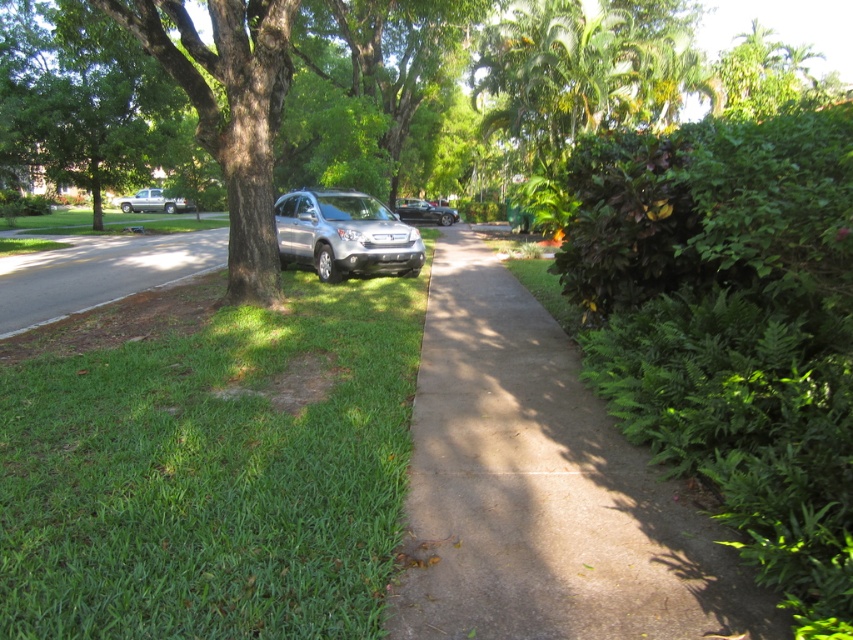
You are a delivery person trying to park your vehicle in a narrow alley that can only accommodate vehicles up to 6 feet in height. You see the silver metallic truck at left and the satin black sedan at center. Which vehicle should you choose to park in the alley?

The satin black sedan at center should be chosen because it is shorter than the silver metallic truck at left, making it suitable for the alley with a 6 feet height restriction.

You are standing at the center of the sidewalk on this suburban street. You see the silver metallic truck at left. Based on its position, can you estimate how far it is from the edge of the sidewalk?

The silver metallic truck at left is positioned at point (152, 202), which indicates it is relatively close to the edge of the sidewalk. However, without specific measurements of the sidewalk width or scale reference, an exact distance cannot be determined. It would be advisable to check local parking regulations or visible markings for proper positioning.